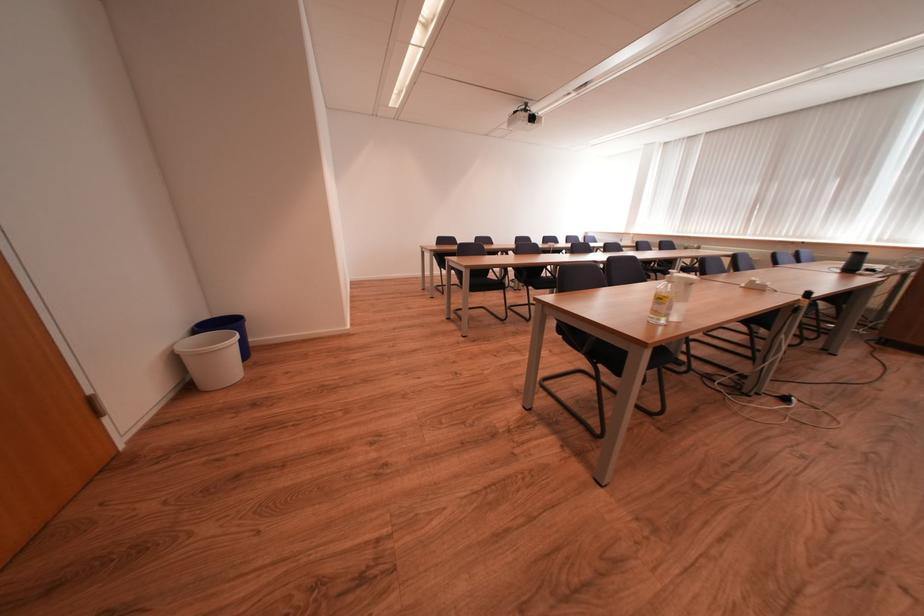
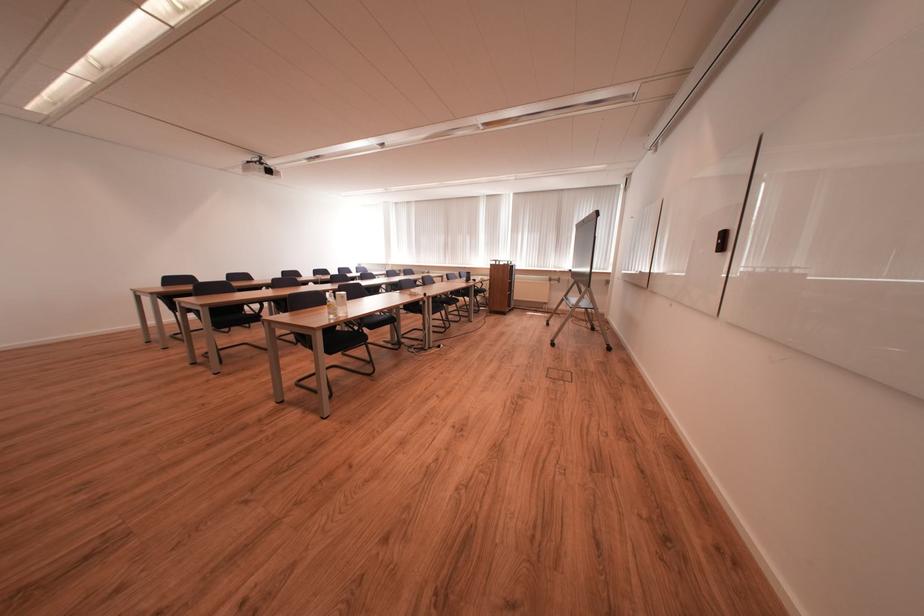
Locate, in the second image, the point that corresponds to point (489, 283) in the first image.

(237, 318)